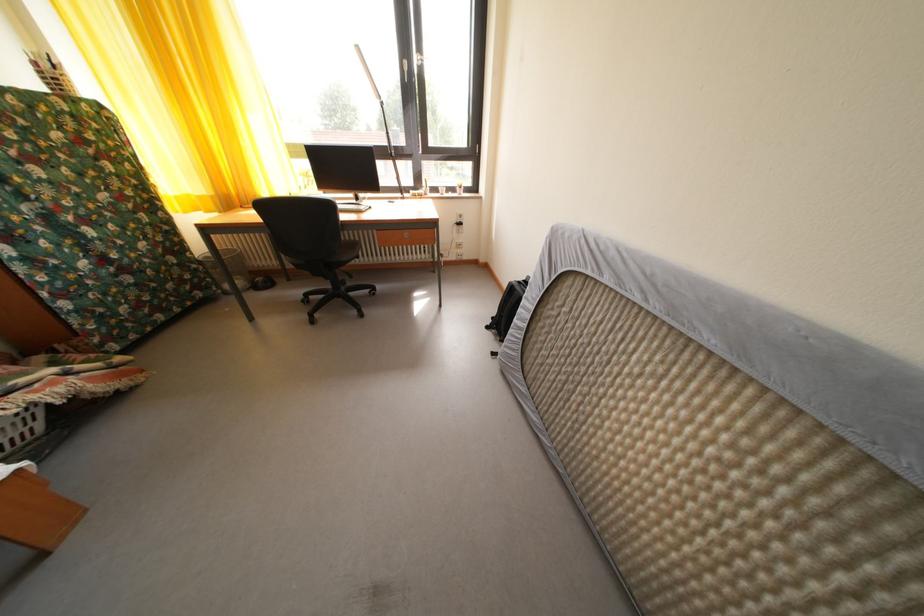
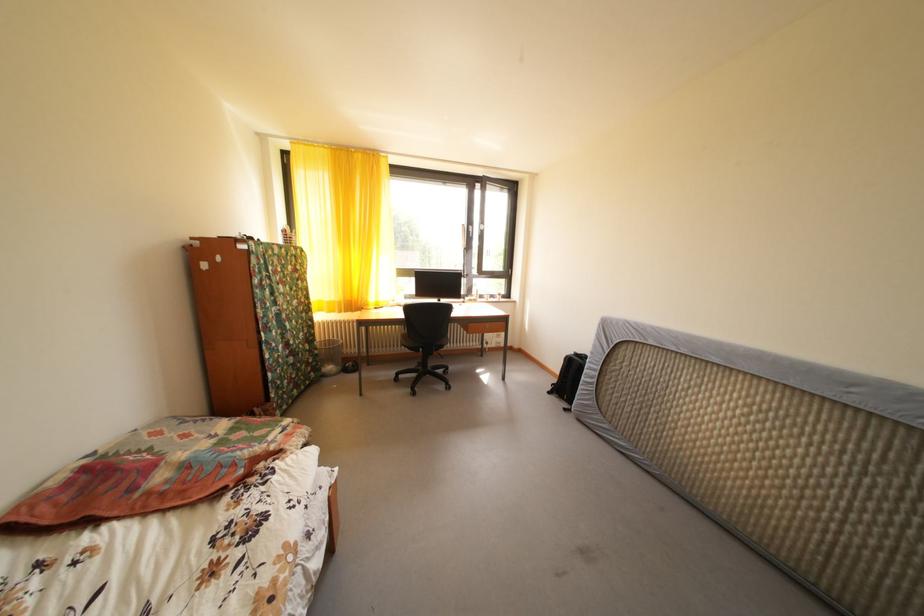
Where in the second image is the point corresponding to (x=497, y=328) from the first image?

(558, 394)